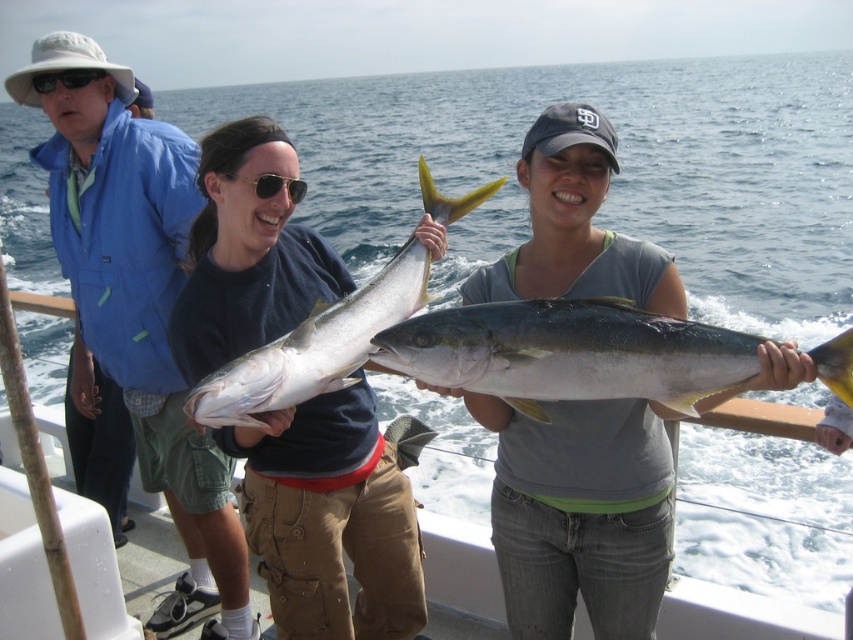
You are a photographer on the boat and want to take a picture of the shiny blue shirt at center and sunglasses at center. Which object should you focus on first if you want to capture both in the same frame?

The shiny blue shirt at center is located below sunglasses at center, so you should focus on the sunglasses at center first to ensure both are in the frame.

You are a marine biologist observing the boat scene. You notice two fish species, the yellow shiny fish at center and the yellowish metallic fish at center. Which fish takes up more space in the image?

The yellowish metallic fish at center occupies more space than the yellow shiny fish at center according to the description.

You are a photographer on the boat and want to take a picture of the sunglasses at center and the black plastic sunglasses at upper left. Which pair of sunglasses is positioned higher in the image?

The sunglasses at center is taller than the black plastic sunglasses at upper left, so the sunglasses at center is positioned higher in the image.